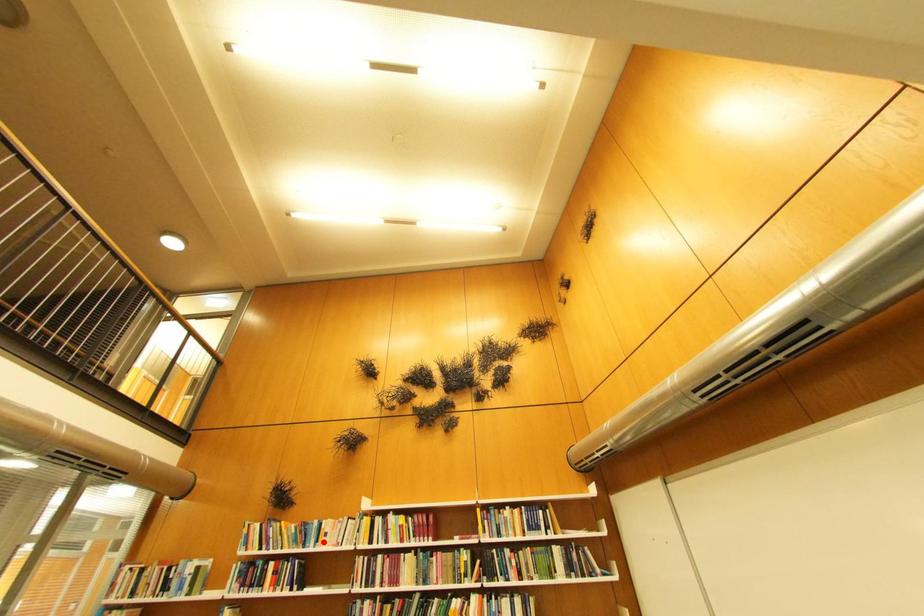
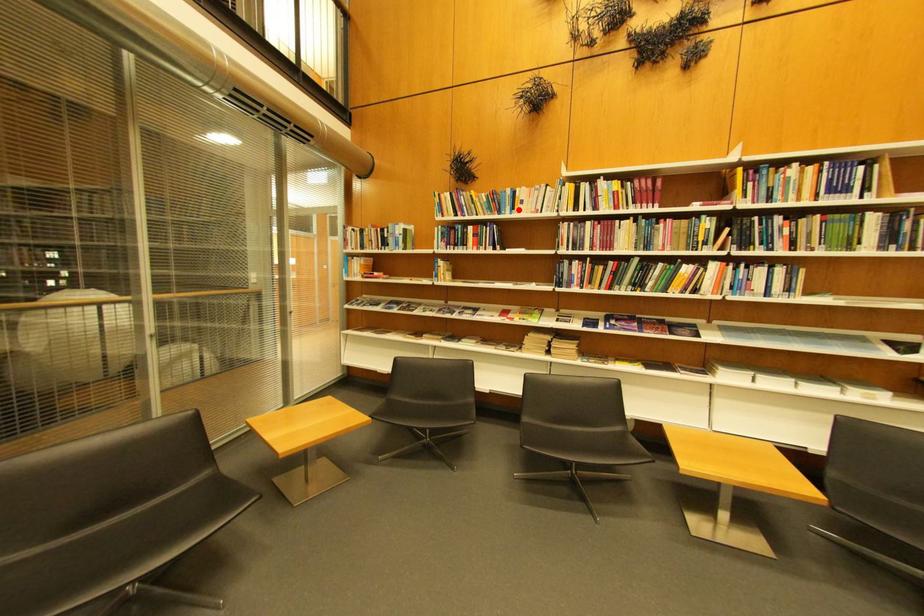
I am providing you with two images of the same scene from different viewpoints. A red point is marked on the first image and another point is marked on the second image. Do the highlighted points in image1 and image2 indicate the same real-world spot?

Yes